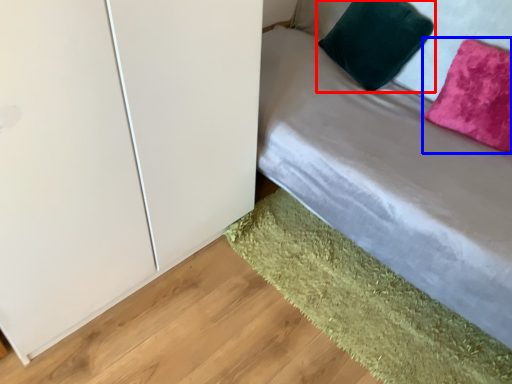
Question: Which of the following is the farthest to the observer, pillow (highlighted by a red box) or pillow (highlighted by a blue box)?

Choices:
 (A) pillow
 (B) pillow

Answer: (A)